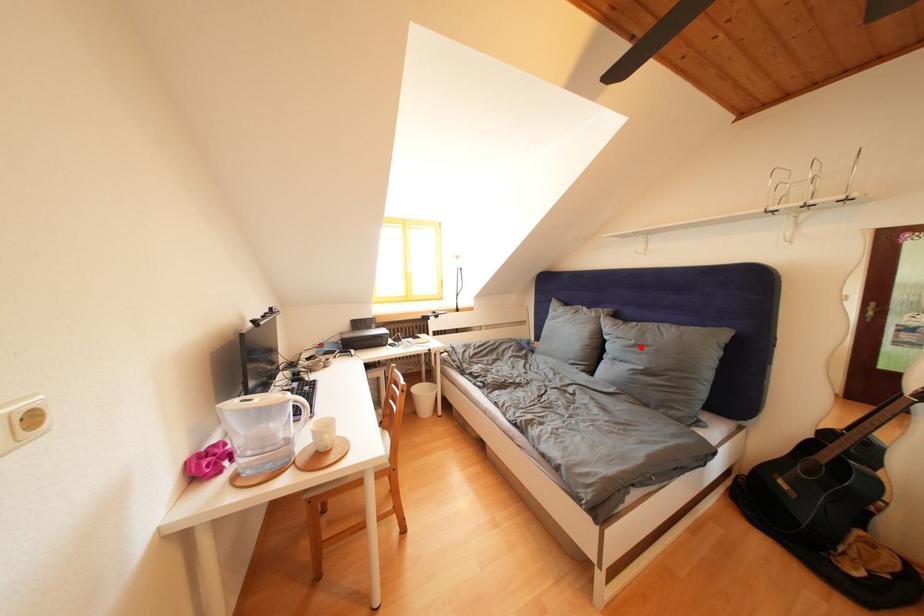
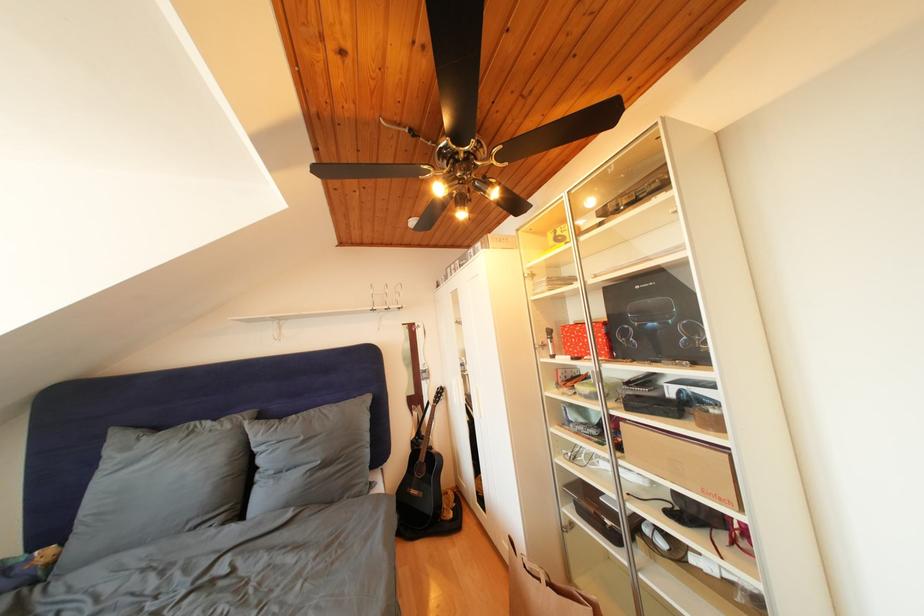
Where in the second image is the point corresponding to the highlighted location from the first image?

(310, 444)